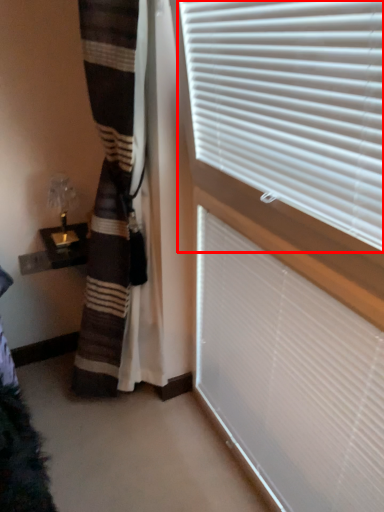
Question: From the image's perspective, what is the correct spatial positioning of window blind (annotated by the red box) in reference to window blind?

Choices:
 (A) above
 (B) below

Answer: (A)